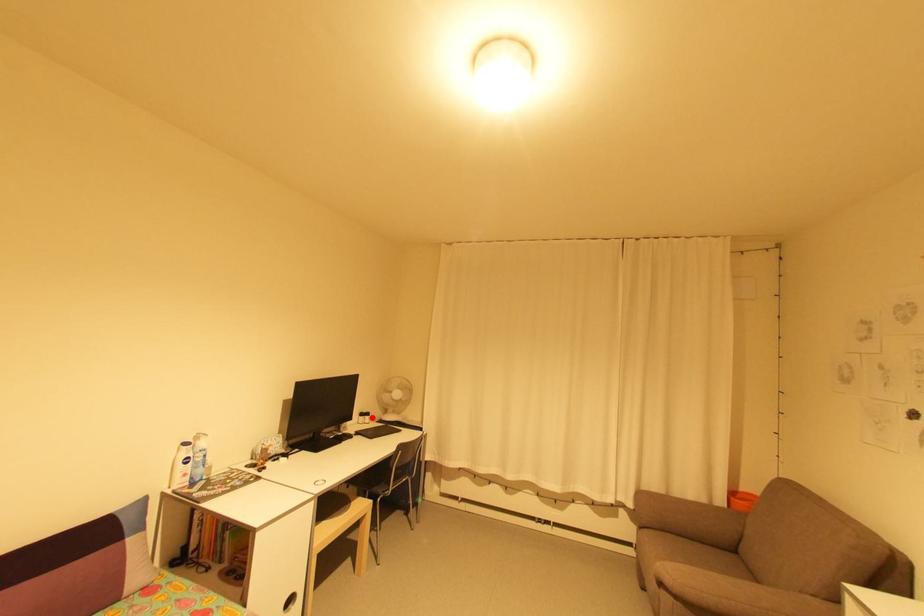
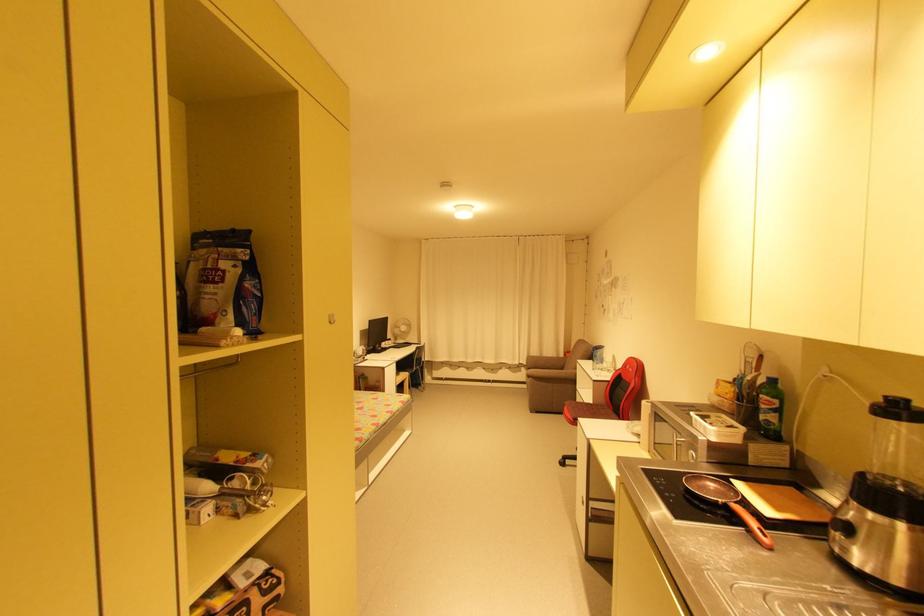
Question: I am providing you with two images of the same scene from different viewpoints. Image1 has a red point marked. In image2, the corresponding 3D location appears at what relative position? Reply with the corresponding letter.

Choices:
 (A) Closer
 (B) Farther

Answer: (A)